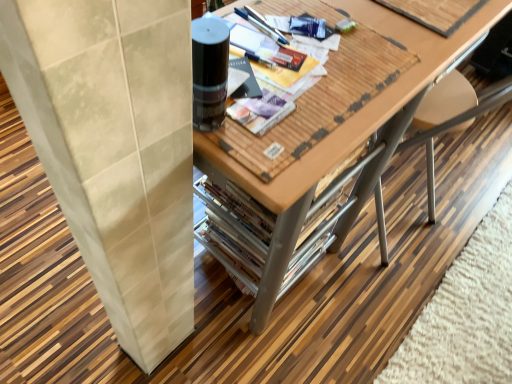
Identify the location of spots to the right of matte black magazine at center, which ranks as the 2th magazine in back-to-front order. The height and width of the screenshot is (384, 512). (365, 71).